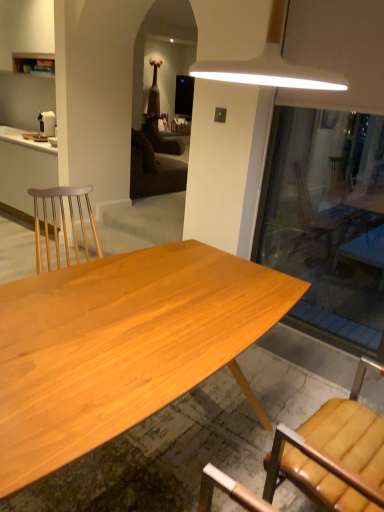
This screenshot has width=384, height=512. I want to click on matte white cabinet at left, so click(24, 170).

What do you see at coordinates (24, 170) in the screenshot?
I see `matte white cabinet at left` at bounding box center [24, 170].

The width and height of the screenshot is (384, 512). Identify the location of white plastic coffee maker at left. (47, 124).

Describe the element at coordinates (47, 124) in the screenshot. The height and width of the screenshot is (512, 384). I see `white plastic coffee maker at left` at that location.

The image size is (384, 512). What are the coordinates of `matte white cabinet at left` in the screenshot? It's located at (24, 170).

Is point (357, 378) in front of point (96, 407)?

No, it is not.

Which of these two, brown leather chair at lower right or natural wood desk at center, is bigger?

With larger size is natural wood desk at center.

Is brown leather chair at lower right shorter than natural wood desk at center?

In fact, brown leather chair at lower right may be taller than natural wood desk at center.

How far apart are brown leather chair at lower right and natural wood desk at center?

A distance of 57.48 centimeters exists between brown leather chair at lower right and natural wood desk at center.

Considering the relative sizes of brown leather chair at lower right and transparent glass door at right in the image provided, is brown leather chair at lower right thinner than transparent glass door at right?

No, brown leather chair at lower right is not thinner than transparent glass door at right.

Does point (331, 412) lie behind point (367, 225)?

No, it is in front of (367, 225).

From a real-world perspective, is brown leather chair at lower right above or below transparent glass door at right?

Clearly, from a real-world perspective, brown leather chair at lower right is below transparent glass door at right.

How many degrees apart are the facing directions of brown leather chair at lower right and transparent glass door at right?

93.6 degrees.

Between natural wood desk at center and matte white cabinet at left, which one appears on the right side from the viewer's perspective?

Positioned to the right is natural wood desk at center.

From a real-world perspective, which is physically above, natural wood desk at center or matte white cabinet at left?

matte white cabinet at left is physically above.

Is natural wood desk at center positioned beyond the bounds of matte white cabinet at left?

natural wood desk at center lies outside matte white cabinet at left's area.

Which is farther from the camera, [227,302] or [19,146]?

The point [19,146] is more distant.

Is white plastic coffee maker at left at the back of brown leather chair at lower right?

That's not correct — brown leather chair at lower right is not looking away from white plastic coffee maker at left.

Between brown leather chair at lower right and white plastic coffee maker at left, which one appears on the left side from the viewer's perspective?

Positioned to the left is white plastic coffee maker at left.

Considering the sizes of objects brown leather chair at lower right and white plastic coffee maker at left in the image provided, who is thinner, brown leather chair at lower right or white plastic coffee maker at left?

white plastic coffee maker at left.

How many degrees apart are the facing directions of brown leather chair at lower right and white plastic coffee maker at left?

brown leather chair at lower right and white plastic coffee maker at left are facing 93.6 degrees away from each other.

Would you say transparent glass door at right is outside brown leather chair at lower right?

Absolutely, transparent glass door at right is external to brown leather chair at lower right.

From a real-world perspective, who is located lower, transparent glass door at right or brown leather chair at lower right?

From a 3D spatial view, brown leather chair at lower right is below.

From the picture: Is transparent glass door at right taller or shorter than brown leather chair at lower right?

Considering their sizes, transparent glass door at right has more height than brown leather chair at lower right.

Is matte white cabinet at left located outside white plastic coffee maker at left?

Yes, matte white cabinet at left is outside of white plastic coffee maker at left.

From a real-world perspective, which object stands above the other?

white plastic coffee maker at left is physically above.

Is point (46, 163) positioned after point (54, 130)?

That is False.

Is white plastic coffee maker at left bigger or smaller than brown leather chair at lower right?

In the image, white plastic coffee maker at left appears to be smaller than brown leather chair at lower right.

Considering the positions of objects white plastic coffee maker at left and brown leather chair at lower right in the image provided, who is in front, white plastic coffee maker at left or brown leather chair at lower right?

Positioned in front is brown leather chair at lower right.

Looking at this image, is white plastic coffee maker at left to the left of brown leather chair at lower right from the viewer's perspective?

Indeed, white plastic coffee maker at left is positioned on the left side of brown leather chair at lower right.

From a real-world perspective, who is located higher, white plastic coffee maker at left or brown leather chair at lower right?

white plastic coffee maker at left.

Locate an element on the screen. chair below the natural wood desk at center (from the image's perspective) is located at coordinates (320, 459).

I want to click on chair on the left of transparent glass door at right, so click(x=320, y=459).

Looking at this image, looking at the image, which one is located further to transparent glass door at right, natural wood desk at center or white plastic coffee maker at left?

Based on the image, white plastic coffee maker at left appears to be further to transparent glass door at right.

Based on their spatial positions, is white plastic coffee maker at left or matte white cabinet at left closer to transparent glass door at right?

Among the two, matte white cabinet at left is located nearer to transparent glass door at right.

From the image, which object appears to be nearer to brown leather chair at lower right, white plastic coffee maker at left or matte white cabinet at left?

Among the two, matte white cabinet at left is located nearer to brown leather chair at lower right.

From the image, which object appears to be nearer to brown leather chair at lower right, natural wood desk at center or matte white cabinet at left?

natural wood desk at center.

From the picture: Based on their spatial positions, is white plastic coffee maker at left or brown leather chair at lower right further from matte white cabinet at left?

The object further to matte white cabinet at left is brown leather chair at lower right.

When comparing their distances from matte white cabinet at left, does transparent glass door at right or white plastic coffee maker at left seem closer?

The object closer to matte white cabinet at left is white plastic coffee maker at left.

Which object lies nearer to the anchor point natural wood desk at center, matte white cabinet at left or brown leather chair at lower right?

brown leather chair at lower right is closer to natural wood desk at center.

Considering their positions, is white plastic coffee maker at left positioned further to natural wood desk at center than transparent glass door at right?

white plastic coffee maker at left is positioned further to the anchor natural wood desk at center.

Locate an element on the screen. chair positioned between natural wood desk at center and transparent glass door at right from near to far is located at coordinates (320, 459).

Locate an element on the screen. The height and width of the screenshot is (512, 384). glass door between natural wood desk at center and matte white cabinet at left from front to back is located at coordinates (327, 222).

The height and width of the screenshot is (512, 384). Identify the location of cabinetry between natural wood desk at center and white plastic coffee maker at left in the front-back direction. (24, 170).

You are a GUI agent. You are given a task and a screenshot of the screen. Output one action in this format:
    pyautogui.click(x=<x>, y=<y>)
    Task: Click on the chair between natural wood desk at center and white plastic coffee maker at left from front to back
    Image resolution: width=384 pixels, height=512 pixels.
    Given the screenshot: What is the action you would take?
    pyautogui.click(x=320, y=459)